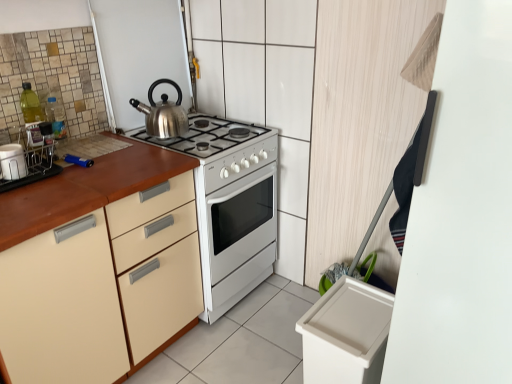
At what (x,y) coordinates should I click in order to perform the action: click on free space in front of matte white container at left. Please return your answer as a coordinate pair (x, y). Looking at the image, I should click on (14, 201).